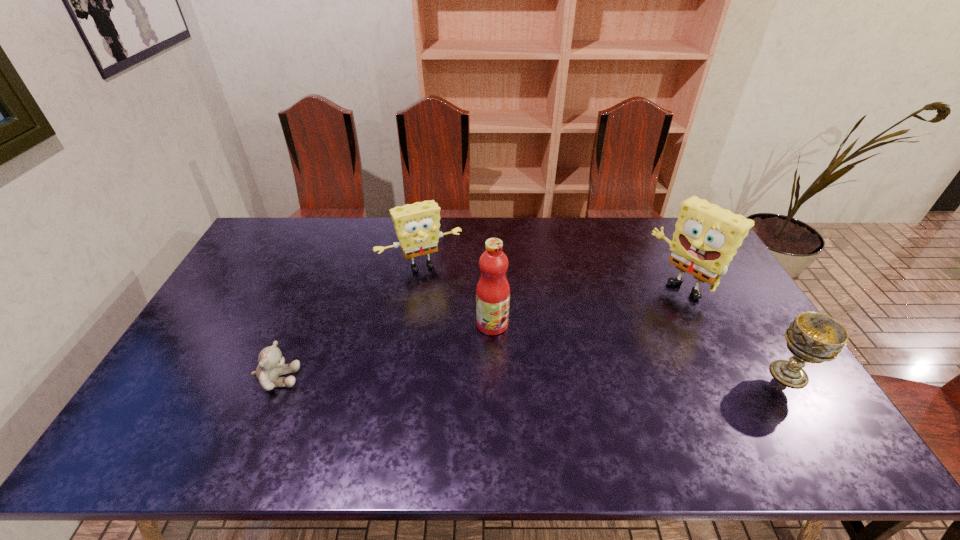
Where is `teddy bear`? The height and width of the screenshot is (540, 960). teddy bear is located at coordinates [271, 365].

At what (x,y) coordinates should I click in order to perform the action: click on the leftmost object. Please return your answer as a coordinate pair (x, y). Looking at the image, I should click on click(271, 365).

The height and width of the screenshot is (540, 960). I want to click on the rightmost object, so click(812, 337).

Identify the location of chalice. (812, 337).

Find the location of a particular element. The width and height of the screenshot is (960, 540). the third tallest object is located at coordinates (417, 225).

I want to click on the shorter sponge, so click(417, 225).

Identify the location of the taller sponge. (706, 239).

Image resolution: width=960 pixels, height=540 pixels. Identify the location of the right sponge. (706, 239).

At what (x,y) coordinates should I click in order to perform the action: click on the third nearest object. Please return your answer as a coordinate pair (x, y). Looking at the image, I should click on (493, 290).

This screenshot has height=540, width=960. I want to click on the third object from left to right, so click(493, 290).